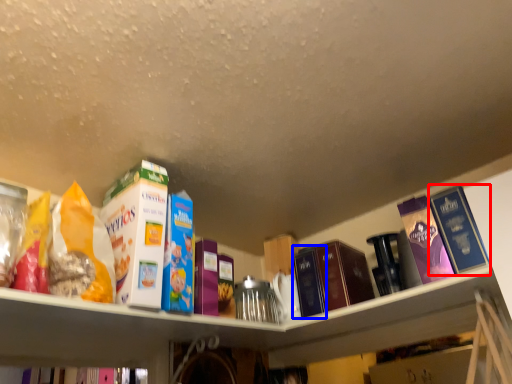
Question: Which object appears closest to the camera in this image, book (highlighted by a red box) or book (highlighted by a blue box)?

Choices:
 (A) book
 (B) book

Answer: (A)